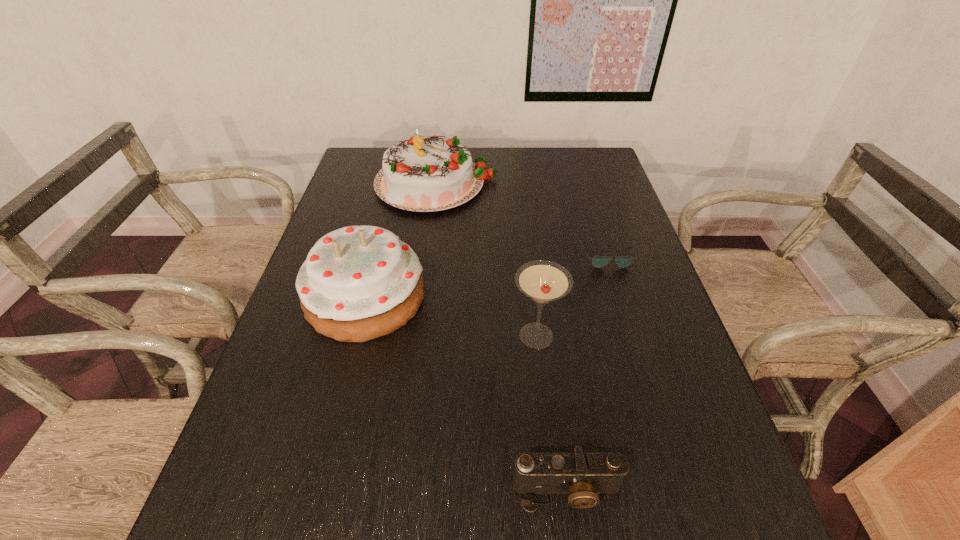
Select which object is the second closest to the camera. Please provide its 2D coordinates. Your answer should be formatted as a tuple, i.e. [(x, y)], where the tuple contains the x and y coordinates of a point satisfying the conditions above.

[(357, 283)]

In order to click on free spot that satisfies the following two spatial constraints: 1. on the front side of the martini; 2. on the right side of the farthest object in this screenshot , I will do `click(417, 336)`.